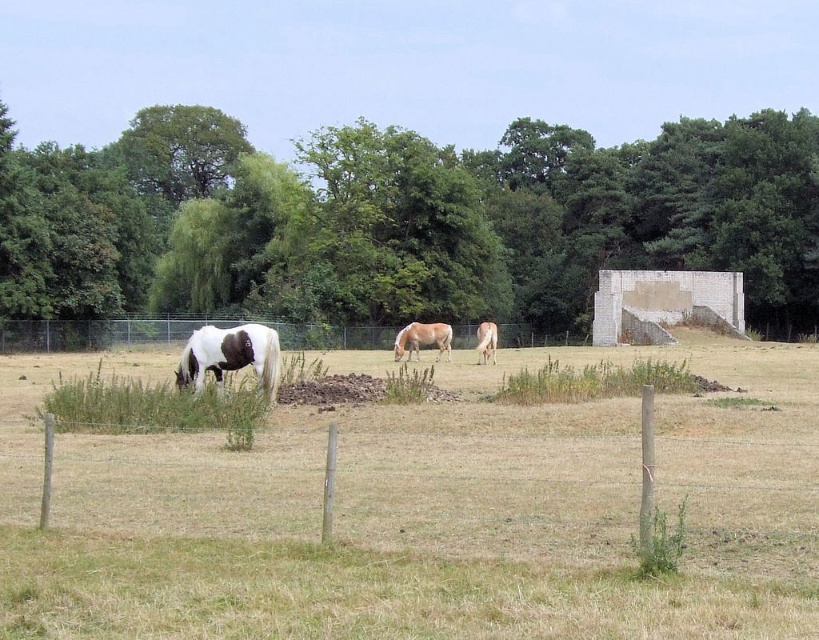
Does metallic chain-link fence at center have a smaller size compared to white glossy horse at center?

Actually, metallic chain-link fence at center might be larger than white glossy horse at center.

Can you confirm if metallic chain-link fence at center is positioned to the right of white glossy horse at center?

Incorrect, metallic chain-link fence at center is not on the right side of white glossy horse at center.

Is point (456, 337) behind point (485, 337)?

Yes, point (456, 337) is farther from viewer.

Locate an element on the screen. metallic chain-link fence at center is located at coordinates (175, 333).

Does point (799, 317) lie in front of point (232, 355)?

No.

Looking at this image, does green leafy tree at upper center have a lesser width compared to white and brown speckled horse at left?

Incorrect, green leafy tree at upper center's width is not less than white and brown speckled horse at left's.

Locate an element on the screen. The width and height of the screenshot is (819, 640). green leafy tree at upper center is located at coordinates tap(403, 220).

Can you confirm if green leafy tree at upper center is bigger than metallic chain-link fence at center?

Yes.

Image resolution: width=819 pixels, height=640 pixels. Find the location of `green leafy tree at upper center`. green leafy tree at upper center is located at coordinates (403, 220).

You are a GUI agent. You are given a task and a screenshot of the screen. Output one action in this format:
    pyautogui.click(x=<x>, y=<y>)
    Task: Click on the green leafy tree at upper center
    The image size is (819, 640).
    Given the screenshot: What is the action you would take?
    pyautogui.click(x=403, y=220)